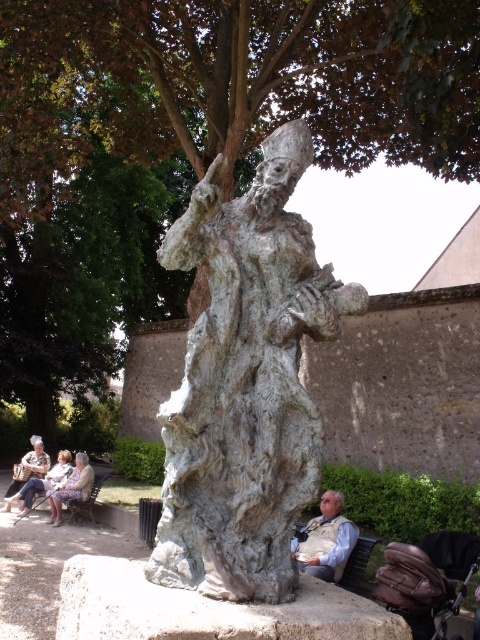
Question: Which object is positioned farthest from the gray stone statue at center?

Choices:
 (A) green leafy tree at center
 (B) light brown leather vest at lower center
 (C) white textured fabric at lower left
 (D) bronze statue at center

Answer: (A)

Question: Is light brown leather vest at lower center below white textured fabric at lower left?

Choices:
 (A) yes
 (B) no

Answer: (B)

Question: Is the position of green leafy tree at center less distant than that of white textured fabric at lower left?

Choices:
 (A) yes
 (B) no

Answer: (A)

Question: Which of the following is the farthest from the observer?

Choices:
 (A) (299, 144)
 (B) (346, 538)
 (C) (159, 140)
 (D) (62, 572)

Answer: (C)

Question: Is gray stone statue at center to the left of light brown leather vest at lower center from the viewer's perspective?

Choices:
 (A) no
 (B) yes

Answer: (B)

Question: Which of these objects is positioned closest to the green leafy tree at center?

Choices:
 (A) gray stone statue at center
 (B) bronze statue at center

Answer: (B)